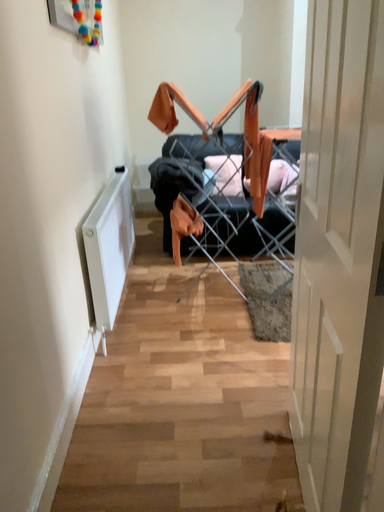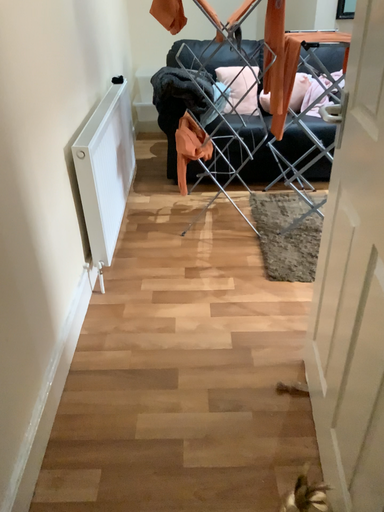
Question: Which way did the camera rotate in the video?

Choices:
 (A) rotated downward
 (B) rotated upward

Answer: (A)